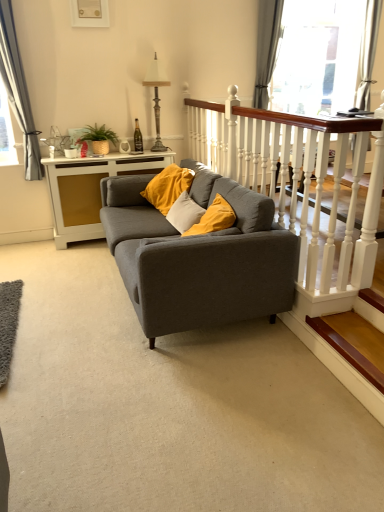
This screenshot has width=384, height=512. Find the location of `vacant space underneath gray fabric curtain at left, which is the third curtain in right-to-left order (from a real-world perspective)`. vacant space underneath gray fabric curtain at left, which is the third curtain in right-to-left order (from a real-world perspective) is located at coordinates (31, 243).